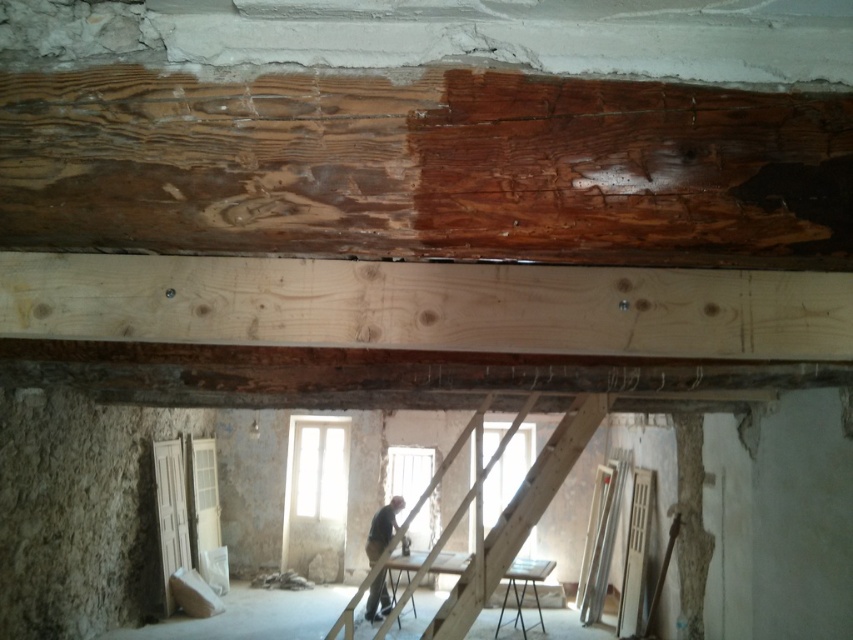
Does natural wood plank at center have a larger size compared to dark gray fabric shirt at center?

No, natural wood plank at center is not bigger than dark gray fabric shirt at center.

Is natural wood plank at center shorter than dark gray fabric shirt at center?

Yes, natural wood plank at center is shorter than dark gray fabric shirt at center.

In order to click on natural wood plank at center in this screenshot , I will do `click(428, 305)`.

Where is `natural wood plank at center`? The height and width of the screenshot is (640, 853). natural wood plank at center is located at coordinates (428, 305).

Does natural wood beam at center have a smaller size compared to dark gray fabric shirt at center?

Yes.

Measure the distance between point (811, 122) and camera.

Point (811, 122) is 1.42 meters from camera.

Where is `natural wood beam at center`? This screenshot has width=853, height=640. natural wood beam at center is located at coordinates (425, 168).

Between wooden at center and dark gray fabric shirt at center, which one appears on the right side from the viewer's perspective?

Positioned to the right is wooden at center.

Is wooden at center below dark gray fabric shirt at center?

No, wooden at center is not below dark gray fabric shirt at center.

Measure the distance between wooden at center and camera.

wooden at center and camera are 5.66 meters apart.

The width and height of the screenshot is (853, 640). Find the location of `wooden at center`. wooden at center is located at coordinates (518, 516).